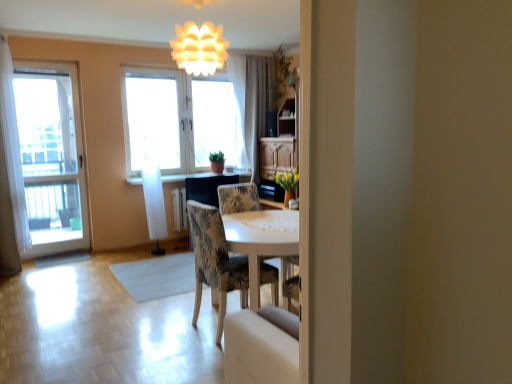
Question: Considering the relative sizes of translucent fabric window at center, the second window positioned from the front, and white sheer curtain at upper center, positioned as the first curtain in right-to-left order, in the image provided, is translucent fabric window at center, the second window positioned from the front, shorter than white sheer curtain at upper center, positioned as the first curtain in right-to-left order,?

Choices:
 (A) no
 (B) yes

Answer: (B)

Question: Considering the relative positions of translucent fabric window at center, acting as the 1th window starting from the back, and white sheer curtain at upper center, which is counted as the second curtain, starting from the front, in the image provided, is translucent fabric window at center, acting as the 1th window starting from the back, behind white sheer curtain at upper center, which is counted as the second curtain, starting from the front,?

Choices:
 (A) no
 (B) yes

Answer: (A)

Question: Is white sheer curtain at upper center, which is counted as the second curtain, starting from the front, at the back of translucent fabric window at center, acting as the 1th window starting from the back?

Choices:
 (A) yes
 (B) no

Answer: (B)

Question: Considering the relative sizes of translucent fabric window at center, the second window positioned from the front, and white sheer curtain at upper center, positioned as the second curtain in left-to-right order, in the image provided, is translucent fabric window at center, the second window positioned from the front, thinner than white sheer curtain at upper center, positioned as the second curtain in left-to-right order,?

Choices:
 (A) no
 (B) yes

Answer: (B)

Question: Considering the relative sizes of translucent fabric window at center, the second window viewed from the left, and white sheer curtain at upper center, which is the first curtain from back to front, in the image provided, is translucent fabric window at center, the second window viewed from the left, wider than white sheer curtain at upper center, which is the first curtain from back to front,?

Choices:
 (A) no
 (B) yes

Answer: (A)

Question: From the image's perspective, is translucent fabric window at center, which appears as the 1th window when viewed from the right, above white sheer curtain at upper center, positioned as the second curtain in left-to-right order?

Choices:
 (A) no
 (B) yes

Answer: (A)

Question: From a real-world perspective, is patterned fabric chair at center positioned under matte black counter top at center based on gravity?

Choices:
 (A) yes
 (B) no

Answer: (A)

Question: Is the depth of patterned fabric chair at center greater than that of matte black counter top at center?

Choices:
 (A) no
 (B) yes

Answer: (A)

Question: From a real-world perspective, is patterned fabric chair at center located higher than matte black counter top at center?

Choices:
 (A) yes
 (B) no

Answer: (B)

Question: Is patterned fabric chair at center positioned beyond the bounds of matte black counter top at center?

Choices:
 (A) yes
 (B) no

Answer: (A)

Question: Is patterned fabric chair at center oriented towards matte black counter top at center?

Choices:
 (A) no
 (B) yes

Answer: (A)

Question: Is patterned fabric chair at center positioned before matte black counter top at center?

Choices:
 (A) no
 (B) yes

Answer: (B)

Question: Is the depth of white sheer curtain at upper center, positioned as the first curtain in right-to-left order, greater than that of transparent glass door at left, which is the 1th window from front to back?

Choices:
 (A) no
 (B) yes

Answer: (B)